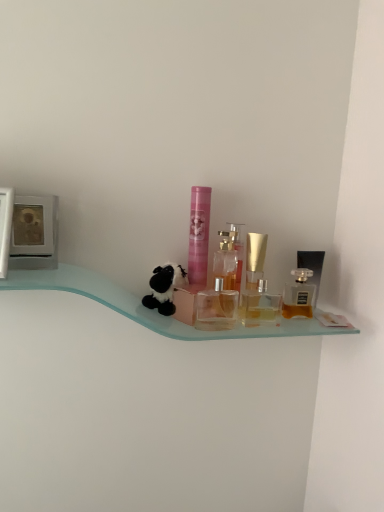
Question: Is transparent plastic perfume bottles at center, which ranks as the second toiletry in left-to-right order, bigger or smaller than clear glass perfume at center, which is counted as the 1th perfume, starting from the left?

Choices:
 (A) big
 (B) small

Answer: (A)

Question: From the image's perspective, relative to clear glass perfume at center, the third perfume positioned from the right, is transparent plastic perfume bottles at center, which ranks as the second toiletry in left-to-right order, above or below?

Choices:
 (A) above
 (B) below

Answer: (B)

Question: Based on their relative distances, which object is farther from the golden glass perfume at right, the 3th perfume viewed from the left?

Choices:
 (A) translucent glass perfume bottle at right, marked as the third toiletry in a left-to-right arrangement
 (B) black plush toy at center
 (C) transparent plastic perfume bottles at center, which ranks as the second toiletry in left-to-right order
 (D) pink matte tube at center, acting as the 1th toiletry starting from the left
 (E) clear glass perfume at center, the third perfume positioned from the right

Answer: (B)

Question: Estimate the real-world distances between objects in this image. Which object is closer to the transparent plastic perfume bottles at center, which appears as the 2th toiletry when viewed from the right?

Choices:
 (A) pink matte tube at center, marked as the 3th toiletry in a right-to-left arrangement
 (B) clear glass perfume at center, the third perfume positioned from the right
 (C) black plush toy at center
 (D) translucent glass perfume bottle at right, the first toiletry from the right
 (E) golden glass perfume at right, placed as the 1th perfume when sorted from right to left

Answer: (E)